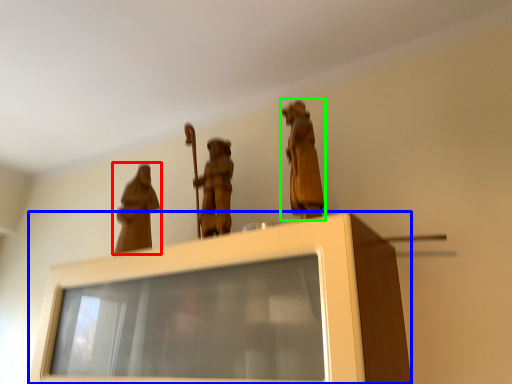
Question: Which object is the closest to the person (highlighted by a red box)? Choose among these: furniture (highlighted by a blue box) or person (highlighted by a green box).

Choices:
 (A) furniture
 (B) person

Answer: (A)